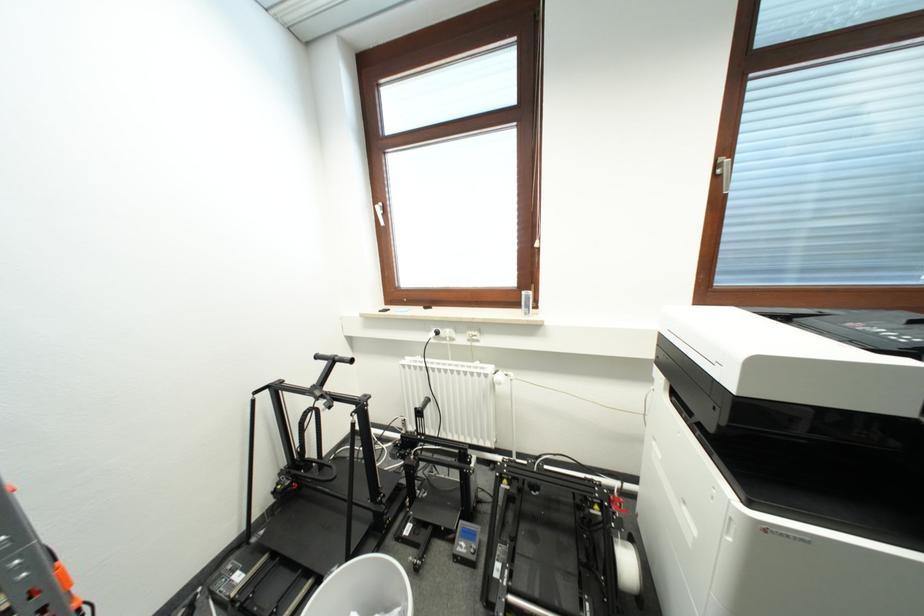
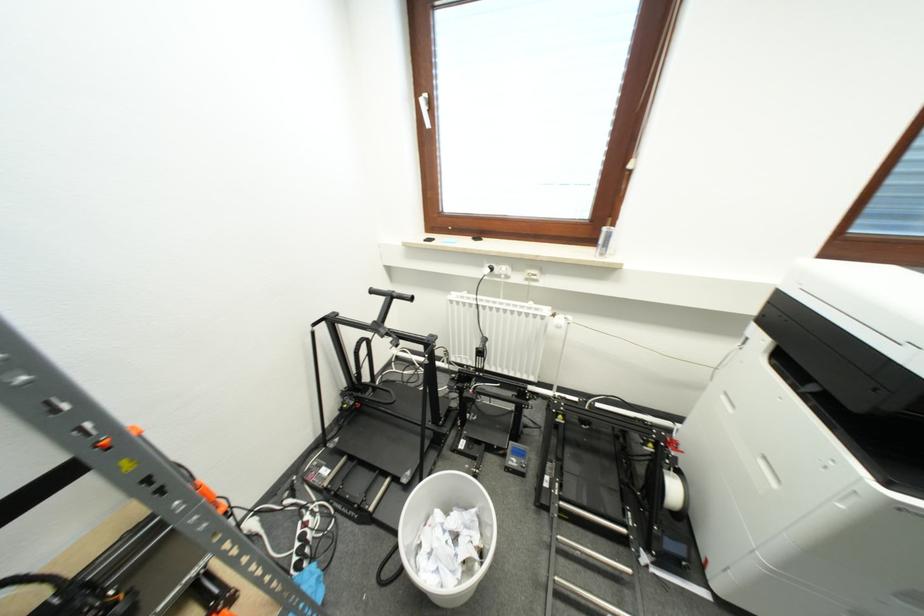
Question: Based on the continuous images, in which direction is the camera rotating? Reply with the corresponding letter.

Choices:
 (A) Left
 (B) Right
 (C) Up
 (D) Down

Answer: (D)